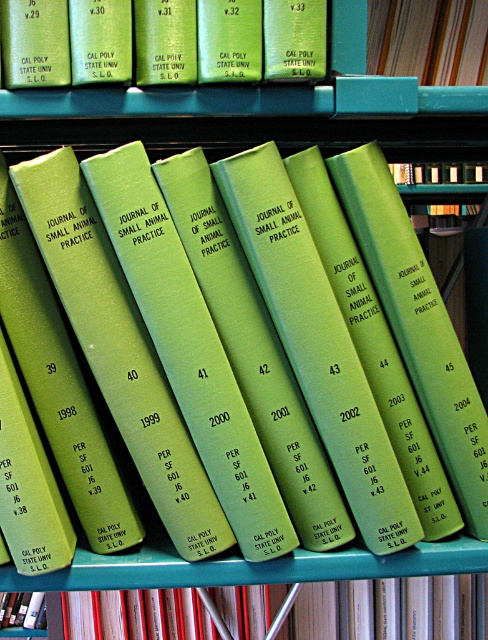
Question: Which object appears farthest from the camera in this image?

Choices:
 (A) green matte book at upper center
 (B) green matte book at center

Answer: (B)

Question: Which point is farther to the camera?

Choices:
 (A) green matte book at upper center
 (B) green matte book at center
 (C) matte green book at center

Answer: (B)

Question: Does green matte book at center come in front of green matte book at upper center?

Choices:
 (A) yes
 (B) no

Answer: (B)

Question: Is matte green book at center further to camera compared to green matte book at upper center?

Choices:
 (A) no
 (B) yes

Answer: (A)

Question: Which object is closer to the camera taking this photo?

Choices:
 (A) green matte book at upper center
 (B) green matte book at center

Answer: (A)

Question: Is matte green book at center smaller than green matte book at center?

Choices:
 (A) no
 (B) yes

Answer: (B)